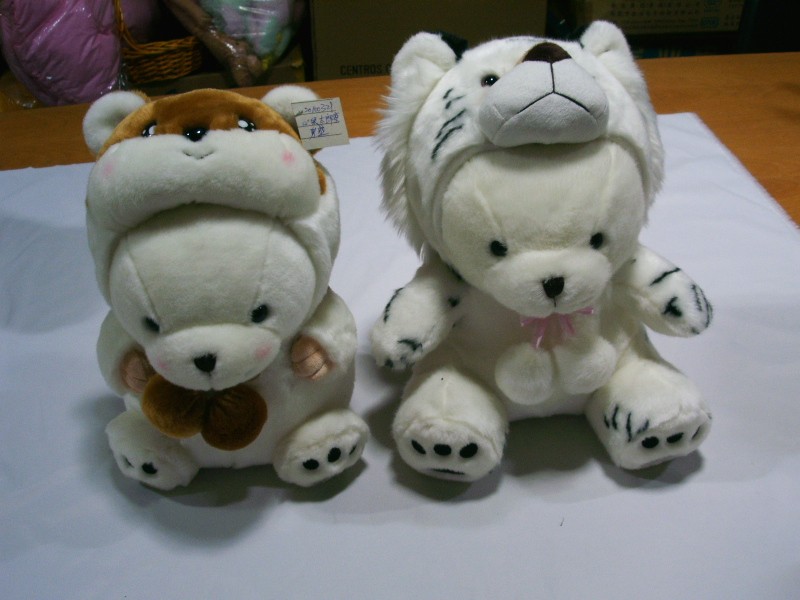
What are the coordinates of `stuffed animals` in the screenshot? It's located at (226, 294), (524, 196).